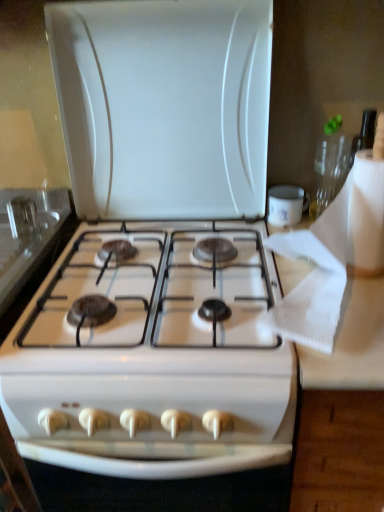
Question: Is white paper towel at right facing towards white glossy gas stove at center?

Choices:
 (A) no
 (B) yes

Answer: (A)

Question: Does white paper towel at right appear on the right side of white glossy gas stove at center?

Choices:
 (A) no
 (B) yes

Answer: (B)

Question: Is white paper towel at right positioned behind white glossy gas stove at center?

Choices:
 (A) yes
 (B) no

Answer: (B)

Question: From the image's perspective, is white paper towel at right on white glossy gas stove at center?

Choices:
 (A) no
 (B) yes

Answer: (B)

Question: Is white paper towel at right at the left side of white glossy gas stove at center?

Choices:
 (A) no
 (B) yes

Answer: (A)

Question: Does white paper towel at right have a smaller size compared to white glossy gas stove at center?

Choices:
 (A) no
 (B) yes

Answer: (B)

Question: Is white glossy gas stove at center far away from white paper towel at right?

Choices:
 (A) no
 (B) yes

Answer: (A)

Question: Can you confirm if white glossy gas stove at center is bigger than white paper towel at right?

Choices:
 (A) no
 (B) yes

Answer: (B)

Question: Does white glossy gas stove at center appear on the right side of white paper towel at right?

Choices:
 (A) yes
 (B) no

Answer: (B)

Question: Does white glossy gas stove at center have a lesser width compared to white paper towel at right?

Choices:
 (A) yes
 (B) no

Answer: (B)

Question: Would you say white glossy gas stove at center is outside white paper towel at right?

Choices:
 (A) no
 (B) yes

Answer: (B)

Question: Is white glossy gas stove at center oriented towards white paper towel at right?

Choices:
 (A) yes
 (B) no

Answer: (B)

Question: Based on their sizes in the image, would you say white paper towel at right is bigger or smaller than white glossy gas stove at center?

Choices:
 (A) small
 (B) big

Answer: (A)